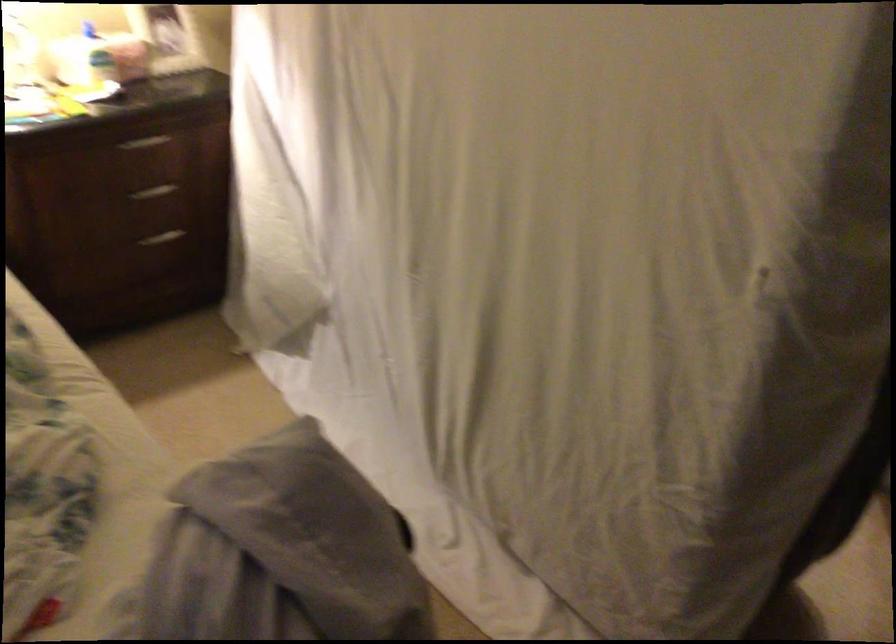
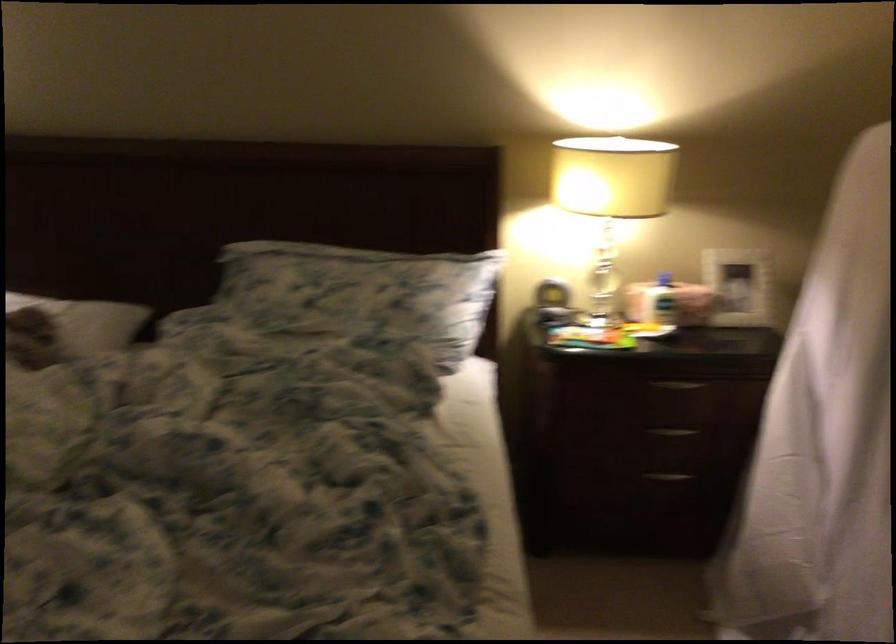
Locate, in the second image, the point that corresponds to [151,198] in the first image.

(672, 431)